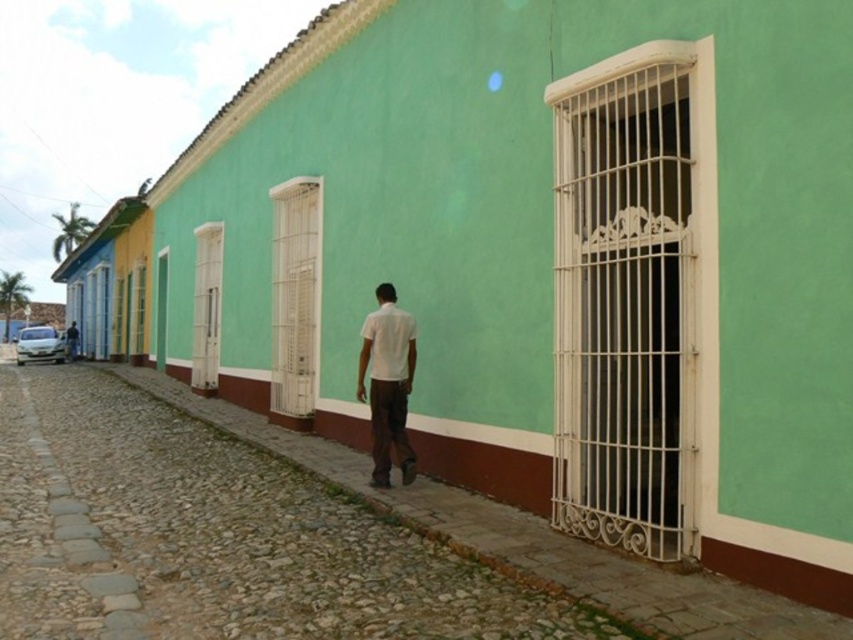
You are standing on the sidewalk in front of the turquoise building and want to walk towards the man who is walking away. Which point, point (410,360) or point (59,348), is closer to you as you start walking?

Point (410,360) is closer to the viewer than point (59,348), so you should head towards that point first as you start walking.